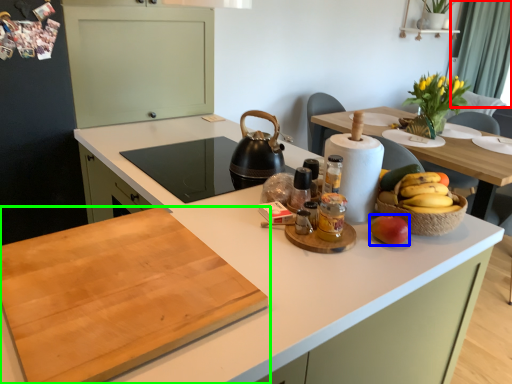
Question: Based on their relative distances, which object is nearer to curtain (highlighted by a red box)? Choose from apple (highlighted by a blue box) and countertop (highlighted by a green box).

Choices:
 (A) apple
 (B) countertop

Answer: (A)